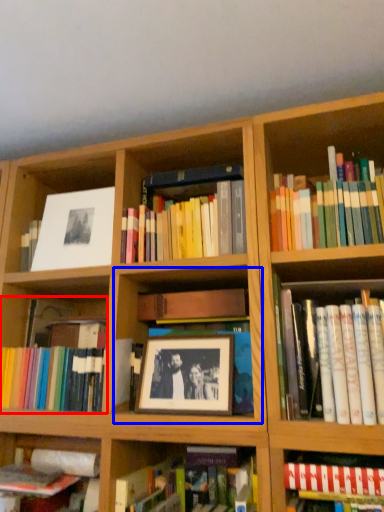
Question: Among these objects, which one is farthest to the camera, book (highlighted by a red box) or cabinet (highlighted by a blue box)?

Choices:
 (A) book
 (B) cabinet

Answer: (A)